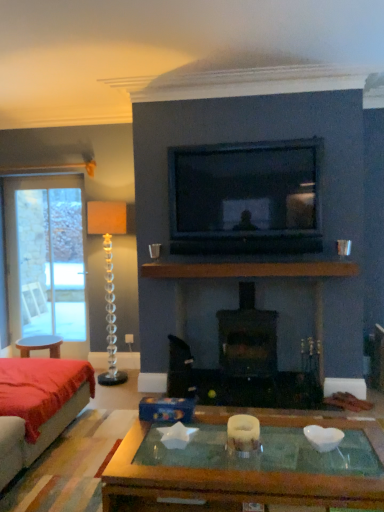
Find the location of a particular element. The image size is (384, 512). vacant region in front of black matte fireplace at center is located at coordinates (256, 399).